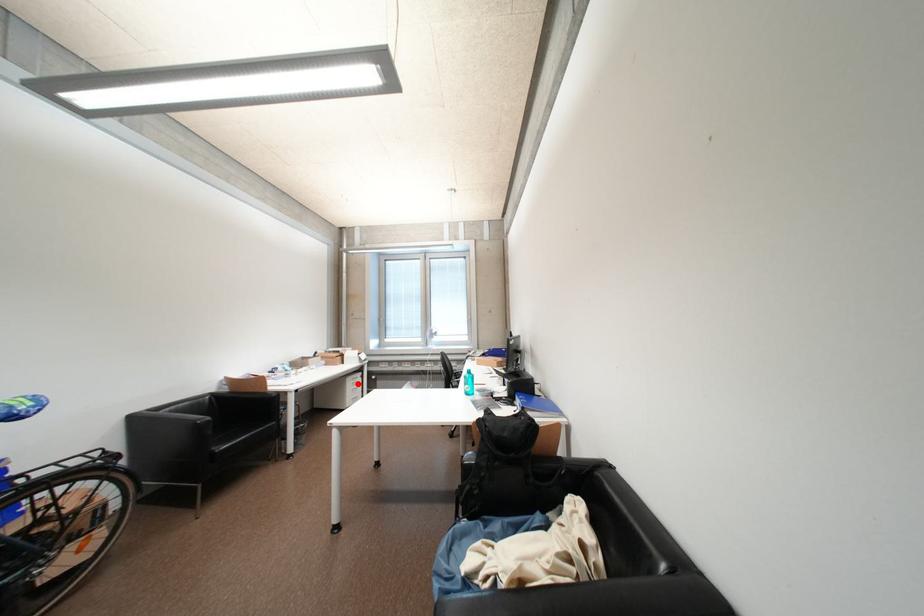
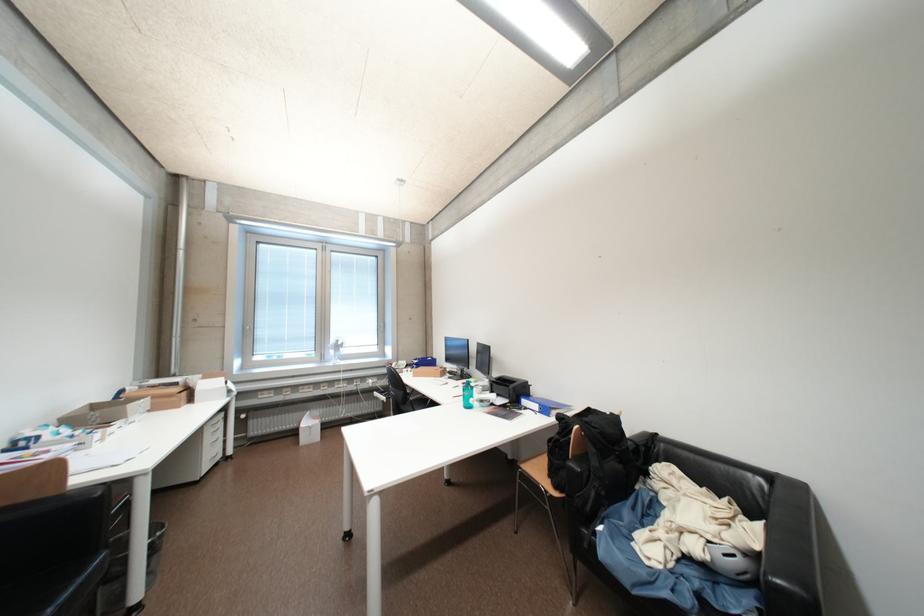
Question: I am providing you with two images of the same scene from different viewpoints. Image1 has a red point marked. In image2, the corresponding 3D location appears at what relative position? Reply with the corresponding letter.

Choices:
 (A) Closer
 (B) Farther

Answer: (A)